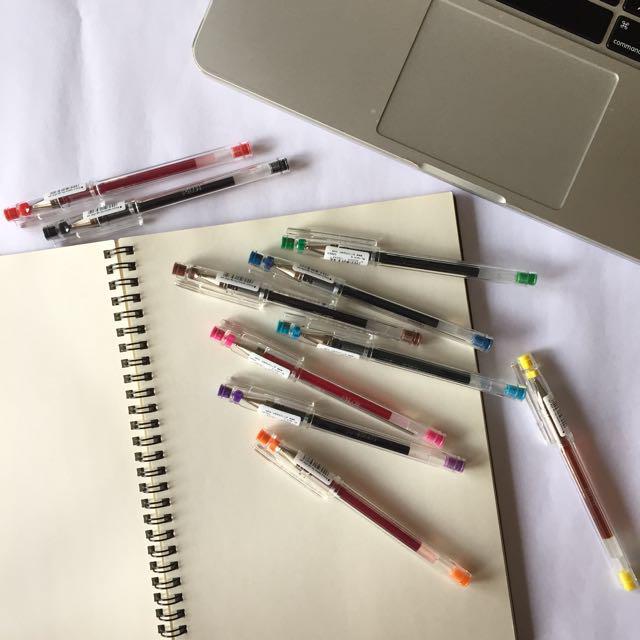
Identify the location of pens. (224, 154), (257, 176), (394, 256), (364, 300), (301, 306), (362, 342), (289, 365), (317, 415), (324, 477), (544, 413).